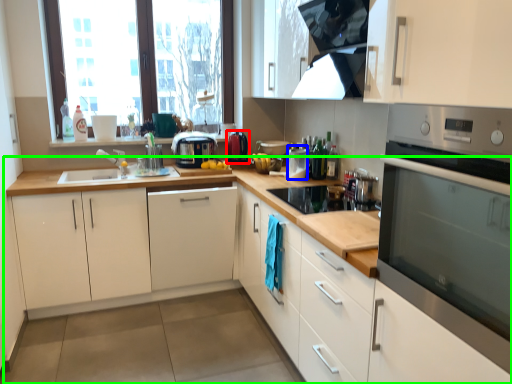
Question: Estimate the real-world distances between objects in this image. Which object is closer to kitchen appliance (highlighted by a red box), appliance (highlighted by a blue box) or countertop (highlighted by a green box)?

Choices:
 (A) appliance
 (B) countertop

Answer: (A)